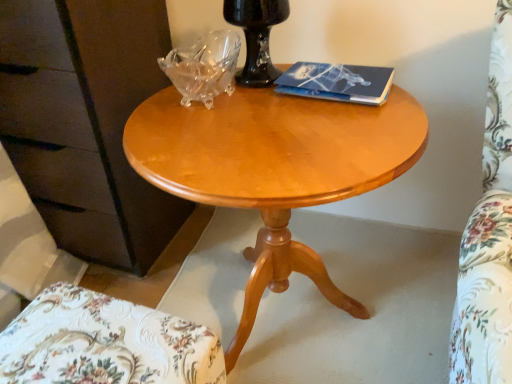
I want to click on blank space above blue matte paper at upper right (from a real-world perspective), so click(x=338, y=71).